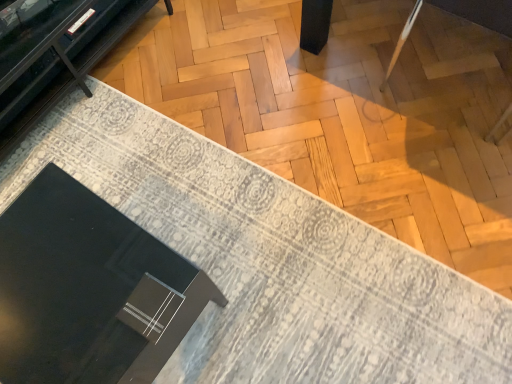
Describe the element at coordinates (61, 65) in the screenshot. I see `matte black tv stand at upper left` at that location.

Locate an element on the screen. The width and height of the screenshot is (512, 384). black glossy round table at lower left is located at coordinates pyautogui.click(x=89, y=290).

Considering the positions of objects matte black tv stand at upper left and matte black box at lower left in the image provided, who is more to the right, matte black tv stand at upper left or matte black box at lower left?

matte black box at lower left is more to the right.

Is matte black tv stand at upper left facing towards matte black box at lower left?

Yes, matte black tv stand at upper left faces towards matte black box at lower left.

Is point (106, 40) closer or farther from the camera than point (377, 42)?

Point (106, 40) appears to be farther away from the viewer than point (377, 42).

How many degrees apart are the facing directions of matte black box at lower left and black glossy round table at lower left?

0.166 degrees separate the facing orientations of matte black box at lower left and black glossy round table at lower left.

Is matte black box at lower left turned away from black glossy round table at lower left?

No, matte black box at lower left's orientation is not away from black glossy round table at lower left.

Considering the sizes of objects matte black box at lower left and black glossy round table at lower left in the image provided, who is taller, matte black box at lower left or black glossy round table at lower left?

Standing taller between the two is black glossy round table at lower left.

Locate an element on the screen. The width and height of the screenshot is (512, 384). plywood below the black glossy round table at lower left (from a real-world perspective) is located at coordinates (346, 113).

In the image, is black glossy round table at lower left positioned in front of or behind matte black tv stand at upper left?

Visually, black glossy round table at lower left is located in front of matte black tv stand at upper left.

Considering the relative sizes of black glossy round table at lower left and matte black tv stand at upper left in the image provided, is black glossy round table at lower left smaller than matte black tv stand at upper left?

Indeed, black glossy round table at lower left has a smaller size compared to matte black tv stand at upper left.

Is black glossy round table at lower left located outside matte black tv stand at upper left?

black glossy round table at lower left lies outside matte black tv stand at upper left's area.

Is black glossy round table at lower left not close to matte black tv stand at upper left?

No, there isn't a large distance between black glossy round table at lower left and matte black tv stand at upper left.

Is point (340, 179) closer or farther from the camera than point (35, 123)?

Point (340, 179) is closer to the camera than point (35, 123).

Is there a large distance between matte black box at lower left and matte black tv stand at upper left?

No, matte black box at lower left is not far away from matte black tv stand at upper left.

Based on the photo, from a real-world perspective, who is located lower, matte black box at lower left or matte black tv stand at upper left?

In real-world perspective, matte black box at lower left is lower.

Does matte black box at lower left have a greater height compared to matte black tv stand at upper left?

No.

Does point (92, 277) lie in front of point (396, 213)?

Yes, point (92, 277) is closer to viewer.

In terms of size, does black glossy round table at lower left appear bigger or smaller than matte black box at lower left?

Clearly, black glossy round table at lower left is larger in size than matte black box at lower left.

From the image's perspective, between black glossy round table at lower left and matte black box at lower left, which one is located above?

matte black box at lower left is shown above in the image.

Would you say black glossy round table at lower left contains matte black box at lower left?

No, matte black box at lower left is located outside of black glossy round table at lower left.

Based on the photo, from a real-world perspective, which object rests below the other?

matte black tv stand at upper left is physically lower.

Considering the relative positions of matte black tv stand at upper left and black glossy round table at lower left in the image provided, is matte black tv stand at upper left to the right of black glossy round table at lower left from the viewer's perspective?

In fact, matte black tv stand at upper left is to the left of black glossy round table at lower left.

Is matte black tv stand at upper left positioned before black glossy round table at lower left?

No, matte black tv stand at upper left is behind black glossy round table at lower left.

Considering the relative sizes of matte black tv stand at upper left and black glossy round table at lower left in the image provided, is matte black tv stand at upper left bigger than black glossy round table at lower left?

Correct, matte black tv stand at upper left is larger in size than black glossy round table at lower left.

Identify the location of plywood on the right of matte black tv stand at upper left. This screenshot has height=384, width=512. (346, 113).

Image resolution: width=512 pixels, height=384 pixels. What are the coordinates of `plywood located behind the black glossy round table at lower left` in the screenshot? It's located at (346, 113).

When comparing their distances from matte black box at lower left, does matte black tv stand at upper left or black glossy round table at lower left seem further?

black glossy round table at lower left is positioned further to the anchor matte black box at lower left.

Which object lies further to the anchor point matte black box at lower left, black glossy round table at lower left or matte black tv stand at upper left?

Among the two, black glossy round table at lower left is located further to matte black box at lower left.

Which object lies further to the anchor point matte black tv stand at upper left, black glossy round table at lower left or matte black box at lower left?

Based on the image, black glossy round table at lower left appears to be further to matte black tv stand at upper left.

Which object lies further to the anchor point matte black tv stand at upper left, matte black box at lower left or black glossy round table at lower left?

black glossy round table at lower left lies further to matte black tv stand at upper left than the other object.

Estimate the real-world distances between objects in this image. Which object is closer to black glossy round table at lower left, matte black box at lower left or matte black tv stand at upper left?

Among the two, matte black tv stand at upper left is located nearer to black glossy round table at lower left.

Which object lies nearer to the anchor point black glossy round table at lower left, matte black tv stand at upper left or matte black box at lower left?

matte black tv stand at upper left is closer to black glossy round table at lower left.

Where is `round table between matte black tv stand at upper left and matte black box at lower left in the horizontal direction`? The height and width of the screenshot is (384, 512). round table between matte black tv stand at upper left and matte black box at lower left in the horizontal direction is located at coordinates (89, 290).